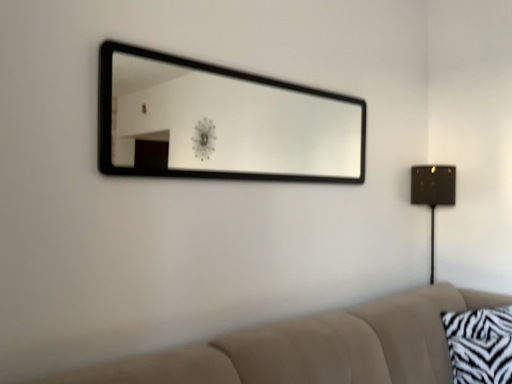
Question: In terms of height, does metallic gold table lamp at right look taller or shorter compared to zebra-patterned fabric pillow at lower right?

Choices:
 (A) tall
 (B) short

Answer: (A)

Question: Is metallic gold table lamp at right situated inside zebra-patterned fabric pillow at lower right or outside?

Choices:
 (A) inside
 (B) outside

Answer: (B)

Question: Which is nearer to the beige fabric couch at lower right?

Choices:
 (A) black frame mirror at upper center
 (B) zebra-patterned fabric pillow at lower right
 (C) metallic gold table lamp at right

Answer: (B)

Question: Which is farther from the metallic gold table lamp at right?

Choices:
 (A) zebra-patterned fabric pillow at lower right
 (B) black frame mirror at upper center
 (C) beige fabric couch at lower right

Answer: (B)